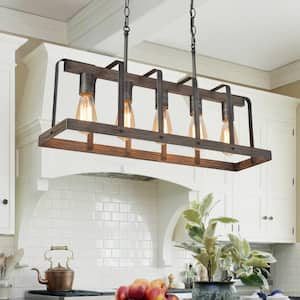
Find the location of a particular element. vase is located at coordinates point(210,292).